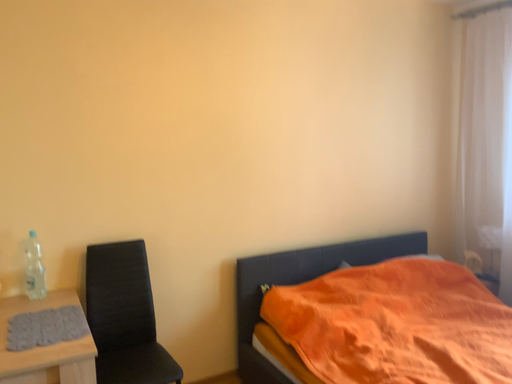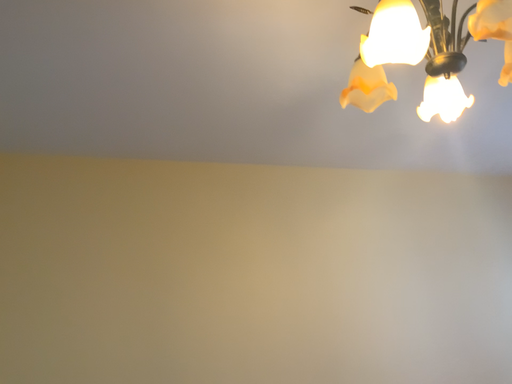
Question: How did the camera likely rotate when shooting the video?

Choices:
 (A) rotated right
 (B) rotated left

Answer: (B)